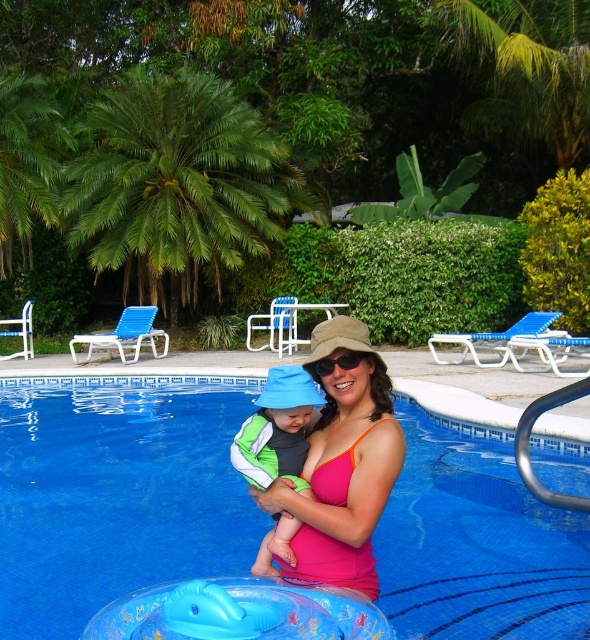
You are standing at the edge of the pool and want to take a photo of the green leafy palm tree at upper left. Your camera has a maximum focus range of 35 feet. Will the palm tree be in focus?

The green leafy palm tree at upper left is 36.03 feet away from the viewer, which exceeds the camera maximum focus range of 35 feet. Therefore, the palm tree will not be in focus.

You are a swimmer who wants to place a pink fabric at center and a green fleece jacket at center on the poolside lounge chairs. Given that the lounge chairs are 1.2 meters wide, can both items fit side by side without overlapping?

The pink fabric at center is wider than the green fleece jacket at center. Since the lounge chairs are 1.2 meters wide, it depends on their combined widths. However, the exact dimensions aren